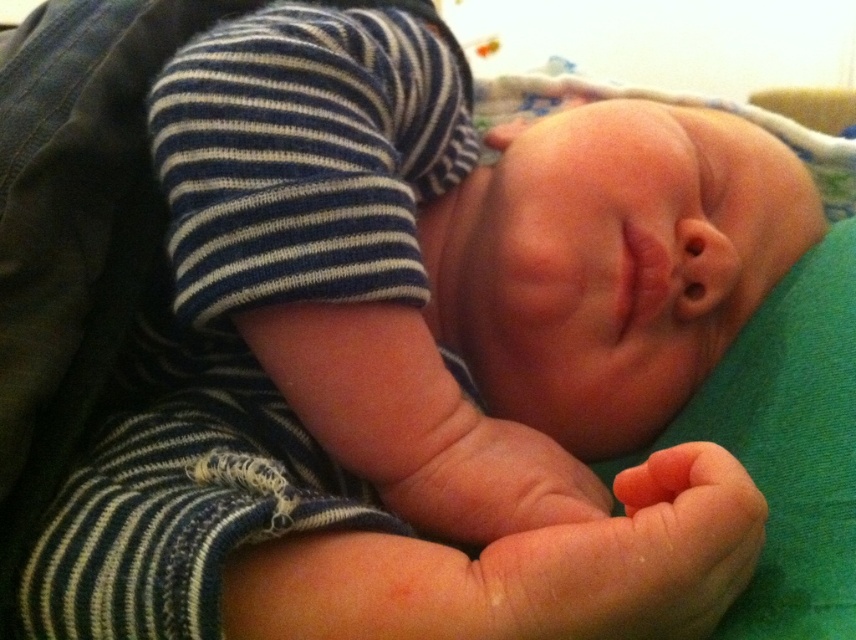
Which is below, pink soft skin at center or smooth skin hand at center?

Positioned lower is pink soft skin at center.

Who is taller, pink soft skin at center or smooth skin hand at center?

pink soft skin at center

Between point (646, 620) and point (405, 468), which one is positioned in front?

Point (646, 620) is in front.

The width and height of the screenshot is (856, 640). Find the location of `pink soft skin at center`. pink soft skin at center is located at coordinates (632, 557).